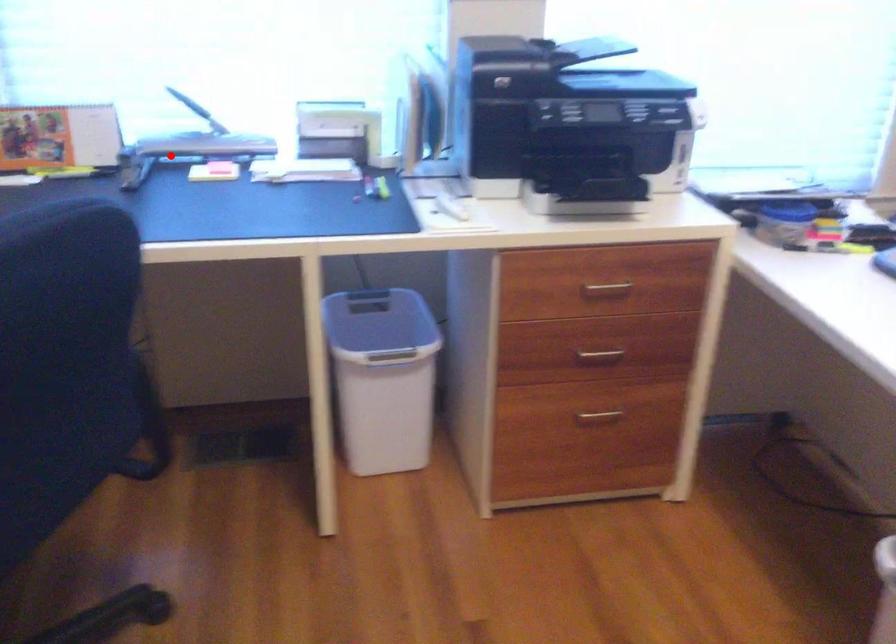
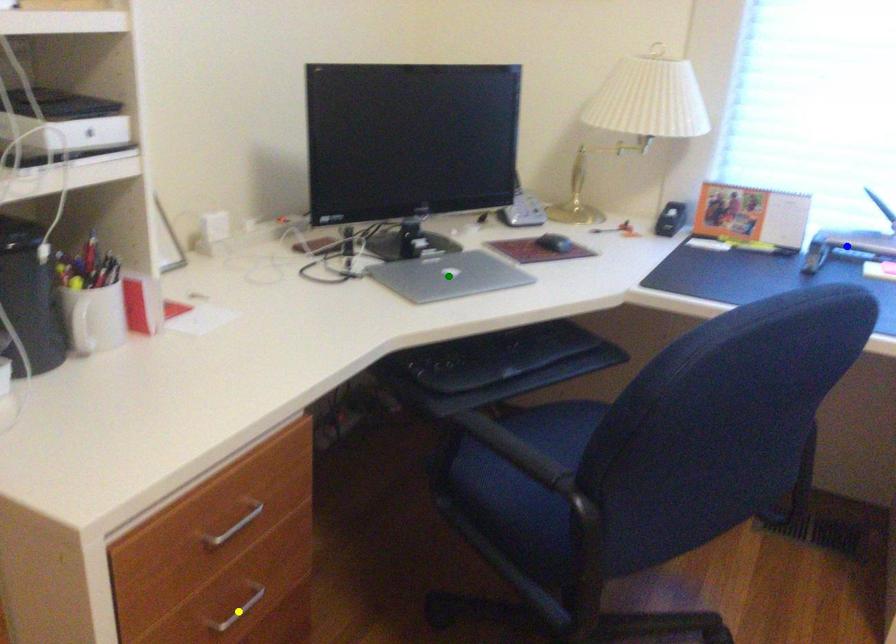
Question: I am providing you with two images of the same scene from different viewpoints. A red point is marked on the first image. You are given multiple points on the second image. In image 2, which mark is for the same physical point as the one in image 1?

Choices:
 (A) green point
 (B) blue point
 (C) yellow point

Answer: (B)